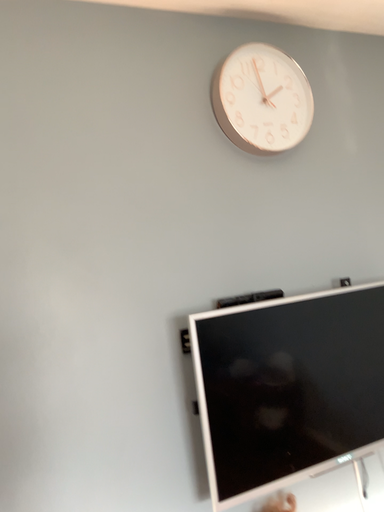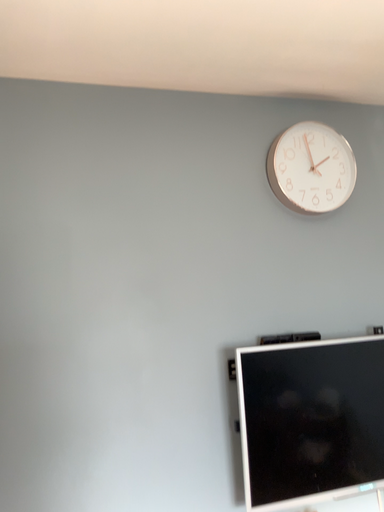
Question: How did the camera likely rotate when shooting the video?

Choices:
 (A) rotated right
 (B) rotated left

Answer: (B)